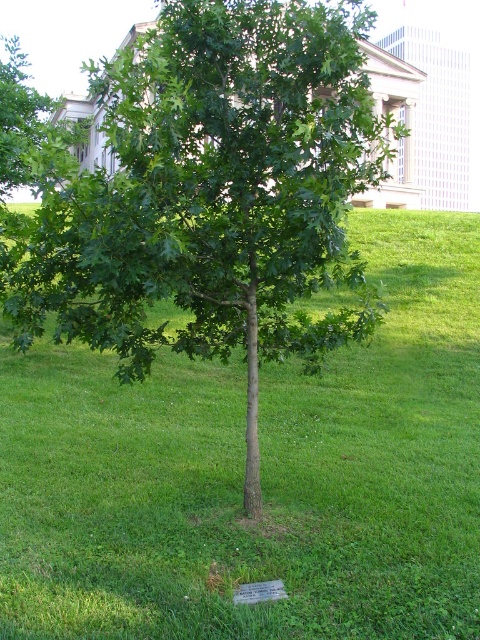
Between point (6, 429) and point (195, 266), which one is positioned behind?

The point (6, 429) is behind.

Between green grass at center and green leafy tree at center, which one appears on the left side from the viewer's perspective?

green leafy tree at center

Describe the element at coordinates (261, 474) in the screenshot. I see `green grass at center` at that location.

Locate an element on the screen. Image resolution: width=480 pixels, height=640 pixels. green grass at center is located at coordinates (261, 474).